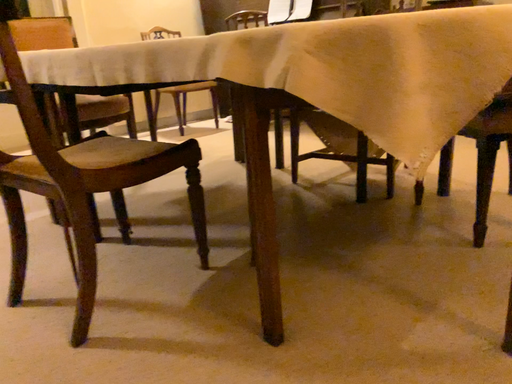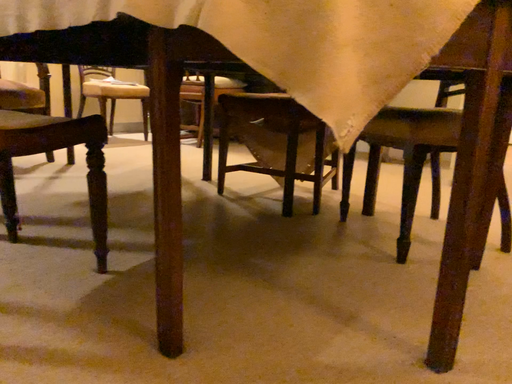
Question: How did the camera likely rotate when shooting the video?

Choices:
 (A) rotated left
 (B) rotated right

Answer: (B)